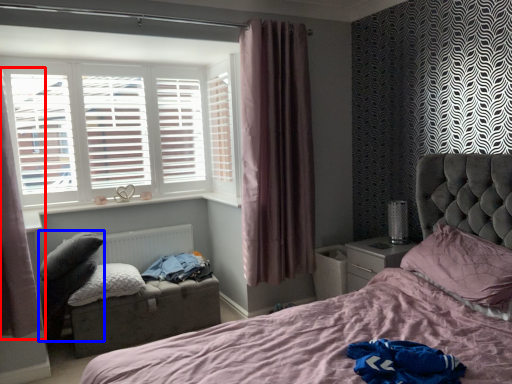
Question: Which point is further to the camera, curtain (highlighted by a red box) or swivel chair (highlighted by a blue box)?

Choices:
 (A) curtain
 (B) swivel chair

Answer: (B)